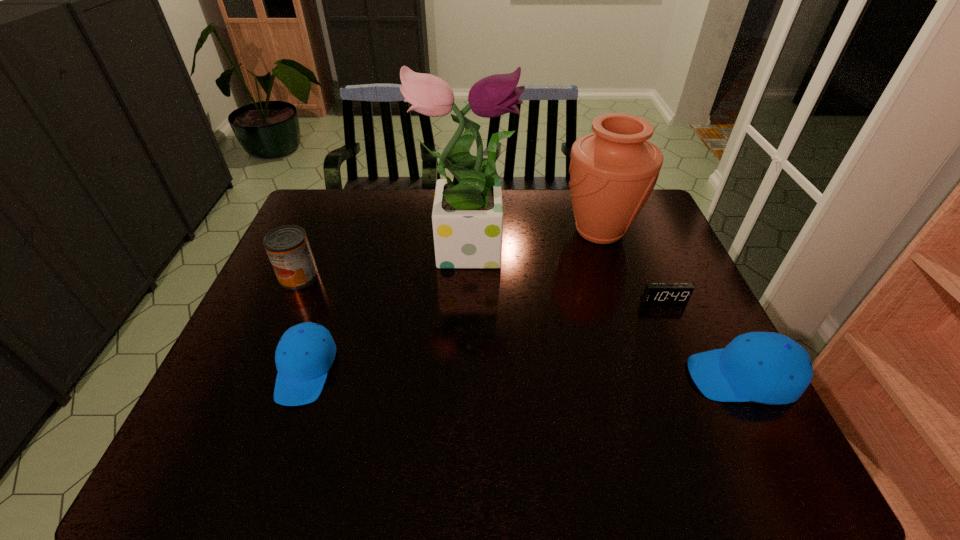
At what (x,y) coordinates should I click in order to perform the action: click on object that is the third closest to the vase. Please return your answer as a coordinate pair (x, y). Looking at the image, I should click on click(x=765, y=367).

Point out which object is positioned as the fourth nearest to the third object from left to right. Please provide its 2D coordinates. Your answer should be formatted as a tuple, i.e. [(x, y)], where the tuple contains the x and y coordinates of a point satisfying the conditions above.

[(655, 293)]

The width and height of the screenshot is (960, 540). Find the location of `free space that satisfies the following two spatial constraints: 1. on the back side of the third tallest object; 2. on the left side of the fifth shortest object`. free space that satisfies the following two spatial constraints: 1. on the back side of the third tallest object; 2. on the left side of the fifth shortest object is located at coordinates (319, 232).

Image resolution: width=960 pixels, height=540 pixels. I want to click on vacant space that satisfies the following two spatial constraints: 1. on the front-facing side of the flower arrangement; 2. on the front-facing side of the shorter cap, so click(461, 370).

Identify the location of vacant point that satisfies the following two spatial constraints: 1. on the front-facing side of the tallest object; 2. on the front-facing side of the shorter cap. Image resolution: width=960 pixels, height=540 pixels. (461, 370).